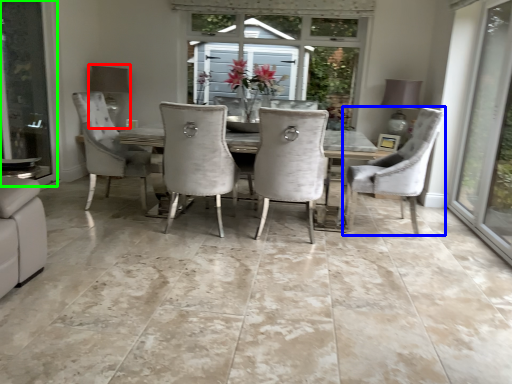
Question: Considering the real-world distances, which object is farthest from lamp (highlighted by a red box)? chair (highlighted by a blue box) or screen door (highlighted by a green box)?

Choices:
 (A) chair
 (B) screen door

Answer: (A)